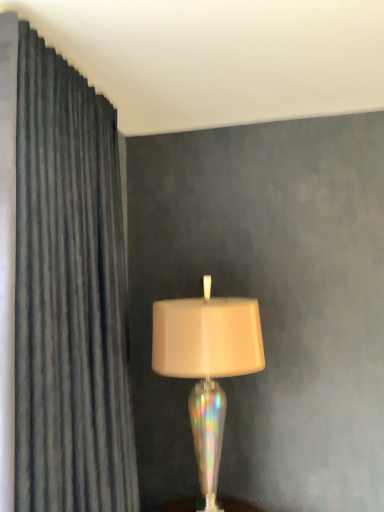
Question: Considering the positions of iridescent glass lamp at center and dark gray textured curtain at left in the image, is iridescent glass lamp at center bigger or smaller than dark gray textured curtain at left?

Choices:
 (A) small
 (B) big

Answer: (A)

Question: From a real-world perspective, is iridescent glass lamp at center positioned above or below dark gray textured curtain at left?

Choices:
 (A) below
 (B) above

Answer: (A)

Question: In terms of width, does iridescent glass lamp at center look wider or thinner when compared to dark gray textured curtain at left?

Choices:
 (A) wide
 (B) thin

Answer: (A)

Question: Is dark gray textured curtain at left to the left or to the right of iridescent glass lamp at center in the image?

Choices:
 (A) right
 (B) left

Answer: (B)

Question: Considering the positions of dark gray textured curtain at left and iridescent glass lamp at center in the image, is dark gray textured curtain at left taller or shorter than iridescent glass lamp at center?

Choices:
 (A) tall
 (B) short

Answer: (A)

Question: From the image's perspective, is dark gray textured curtain at left above or below iridescent glass lamp at center?

Choices:
 (A) below
 (B) above

Answer: (B)

Question: Considering the positions of dark gray textured curtain at left and iridescent glass lamp at center in the image, is dark gray textured curtain at left bigger or smaller than iridescent glass lamp at center?

Choices:
 (A) small
 (B) big

Answer: (B)